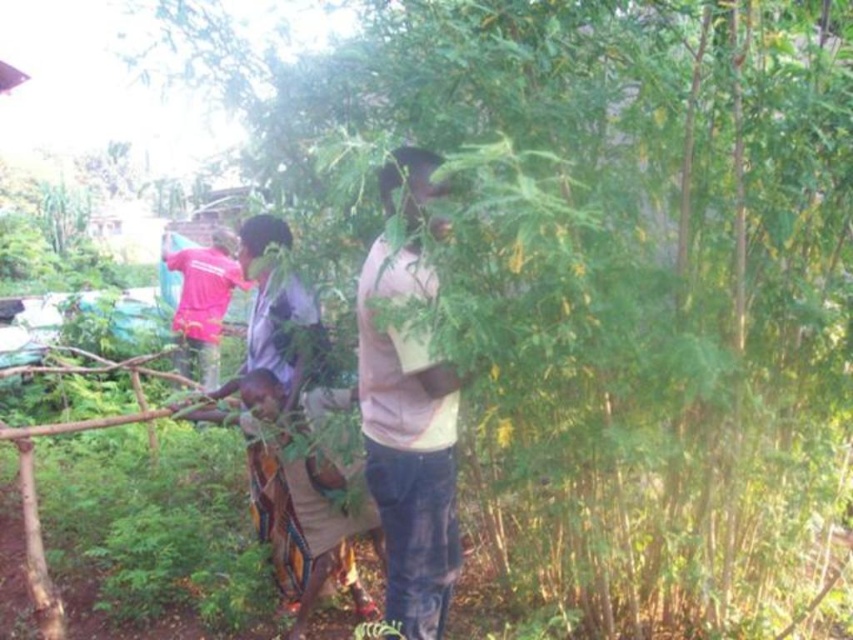
What is located at the coordinates point (x=408, y=445)?

The pink cotton shirt at center is located at point (x=408, y=445).

You are a visitor in this agricultural scene. You see the pink cotton shirt at center and the pink fabric at upper left. Which object is located to the right side of the other?

The pink cotton shirt at center is to the right of the pink fabric at upper left.

You are a photographer trying to capture a clear shot of the pink cotton shirt at center without the pink fabric at upper left blocking it. Can you adjust your position to achieve this?

Yes, since the pink cotton shirt at center is in front of the pink fabric at upper left, you can move your camera angle slightly to focus on the pink cotton shirt at center while avoiding the pink fabric at upper left behind it.